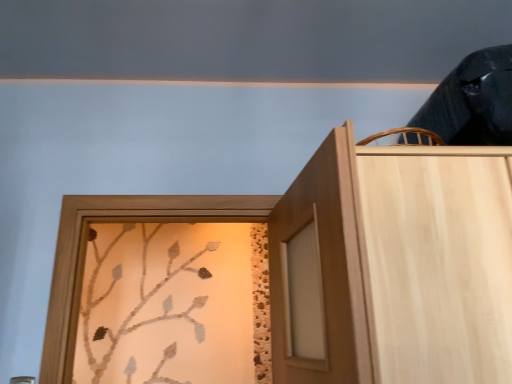
Measure the distance between point [452,81] and camera.

The distance of point [452,81] from camera is 4.19 feet.

What do you see at coordinates (473, 101) in the screenshot? I see `dark blue fabric at upper right` at bounding box center [473, 101].

Find the location of `dark blue fabric at upper right`. dark blue fabric at upper right is located at coordinates (473, 101).

Where is `dark blue fabric at upper right`? dark blue fabric at upper right is located at coordinates (473, 101).